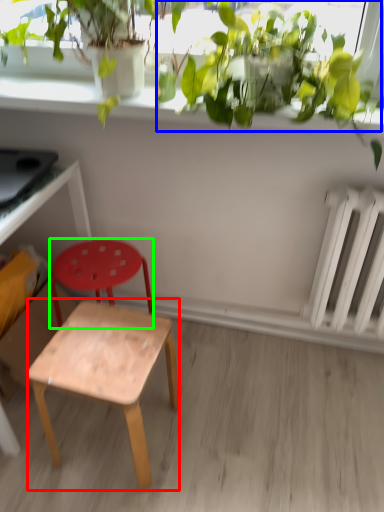
Question: Which is farther away from stool (highlighted by a red box)? vegetation (highlighted by a blue box) or stool (highlighted by a green box)?

Choices:
 (A) vegetation
 (B) stool

Answer: (A)